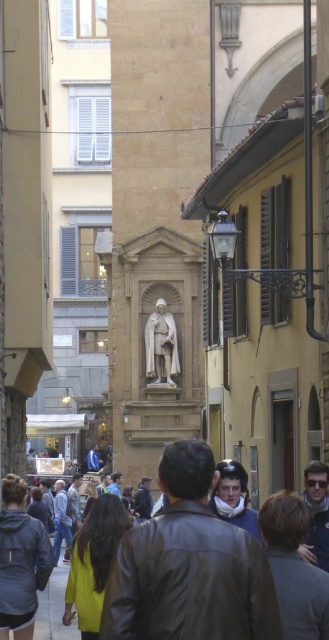
Question: Is dark gray jacket at lower left bigger than dark brown leather jacket at lower left?

Choices:
 (A) yes
 (B) no

Answer: (B)

Question: Where is leather jacket at center located in relation to dark gray jacket at center in the image?

Choices:
 (A) right
 (B) left

Answer: (A)

Question: Which of the following is the farthest from the observer?

Choices:
 (A) (217, 528)
 (B) (70, 540)

Answer: (B)

Question: Which object is positioned closest to the white marble statue at center?

Choices:
 (A) white scarf at center
 (B) leather jacket at center
 (C) dark gray jacket at lower left

Answer: (A)

Question: Estimate the real-world distances between objects in this image. Which object is farther from the blue denim jacket at center?

Choices:
 (A) yellow fabric hair at center
 (B) white marble statue at center

Answer: (A)

Question: Can you confirm if white scarf at center is wider than blue denim jacket at center?

Choices:
 (A) no
 (B) yes

Answer: (B)